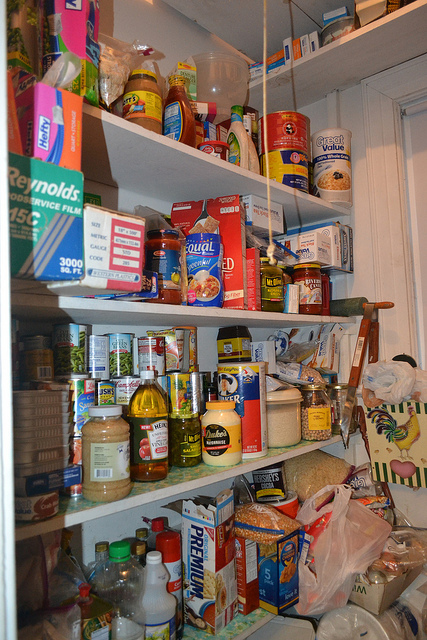
Identify the location of shelf. (213, 474).